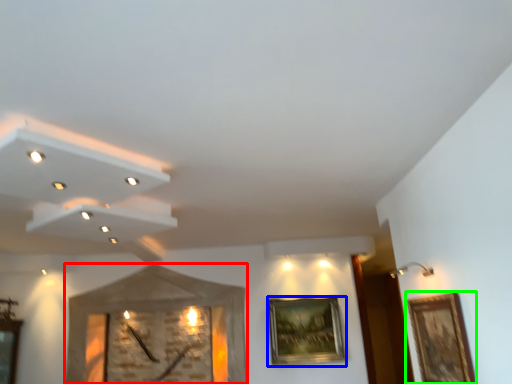
Question: Which object is the farthest from clock (highlighted by a red box)? Choose among these: picture frame (highlighted by a blue box) or picture frame (highlighted by a green box).

Choices:
 (A) picture frame
 (B) picture frame

Answer: (B)